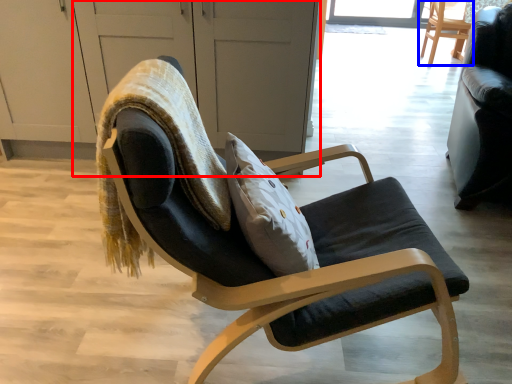
Question: Which object appears farthest to the camera in this image, screen door (highlighted by a red box) or chair (highlighted by a blue box)?

Choices:
 (A) screen door
 (B) chair

Answer: (B)